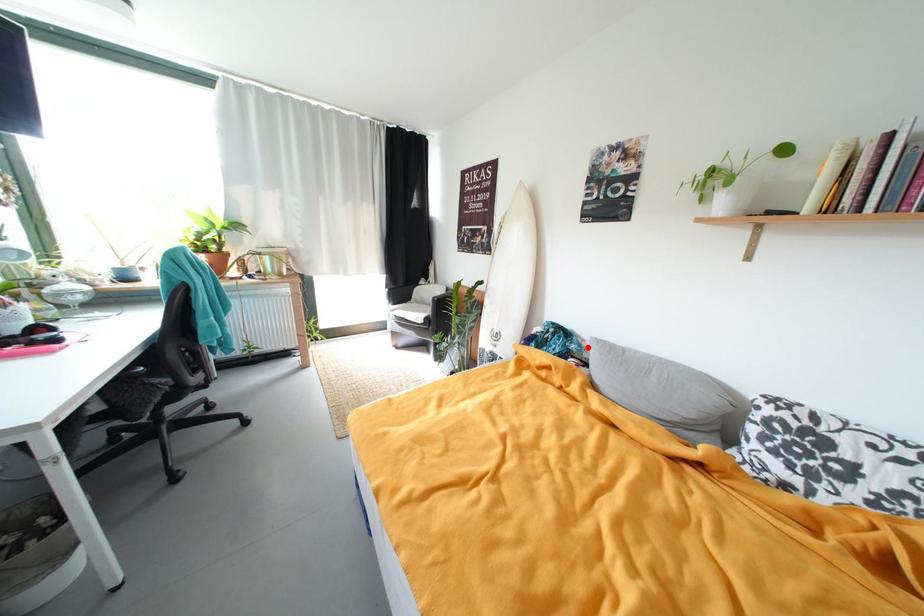
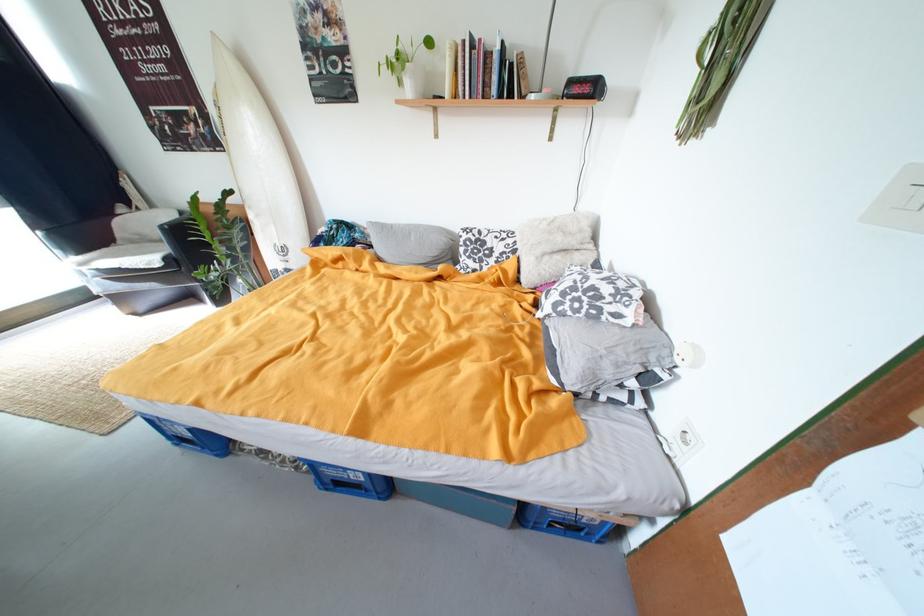
Find the pixel in the second image that matches the highlighted location in the first image.

(371, 235)